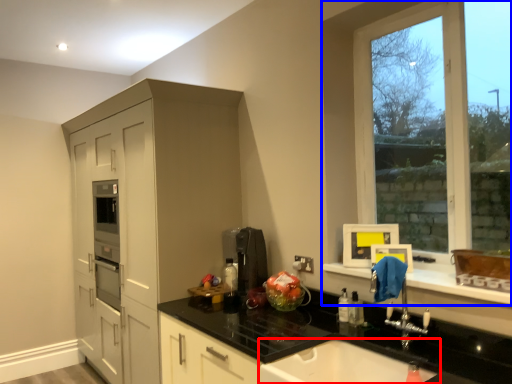
Question: Which object is closer to the camera taking this photo, sink (highlighted by a red box) or window (highlighted by a blue box)?

Choices:
 (A) sink
 (B) window

Answer: (A)